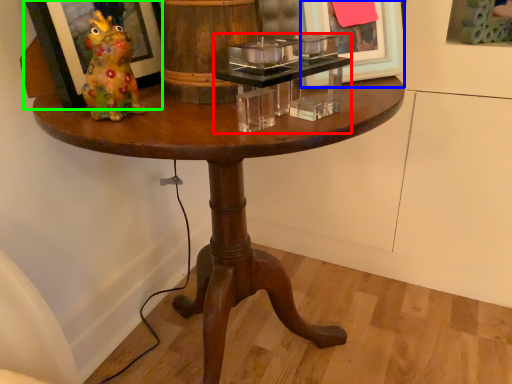
Question: Which object is the closest to the candle holder (highlighted by a red box)? Choose among these: picture frame (highlighted by a blue box) or picture frame (highlighted by a green box).

Choices:
 (A) picture frame
 (B) picture frame

Answer: (A)